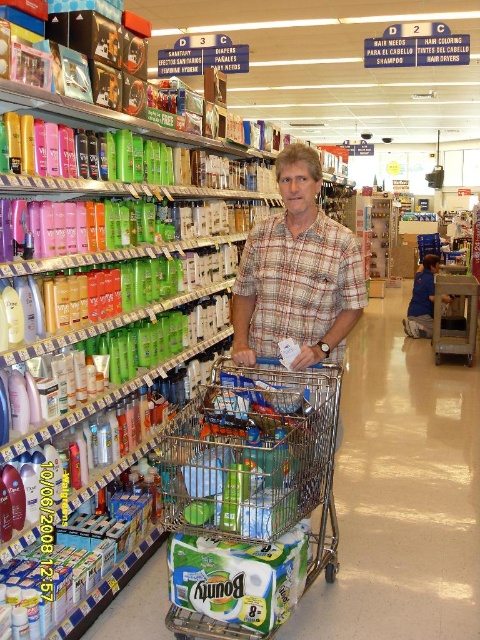
Question: Is metallic silver trolley at center wider than plaid cotton shirt at center?

Choices:
 (A) no
 (B) yes

Answer: (B)

Question: Which point is closer to the camera?

Choices:
 (A) metallic silver trolley at center
 (B) plaid cotton shirt at center
 (C) metallic silver shopping cart at center

Answer: (A)

Question: Can you confirm if metallic silver trolley at center is positioned below metallic silver shopping cart at center?

Choices:
 (A) yes
 (B) no

Answer: (A)

Question: Which object is the farthest from the metallic silver shopping cart at center?

Choices:
 (A) plaid cotton shirt at center
 (B) metallic silver trolley at center

Answer: (B)

Question: Is metallic silver trolley at center below metallic silver shopping cart at center?

Choices:
 (A) no
 (B) yes

Answer: (B)

Question: Which object appears closest to the camera in this image?

Choices:
 (A) metallic silver shopping cart at center
 (B) metallic silver trolley at center
 (C) plaid cotton shirt at center

Answer: (B)